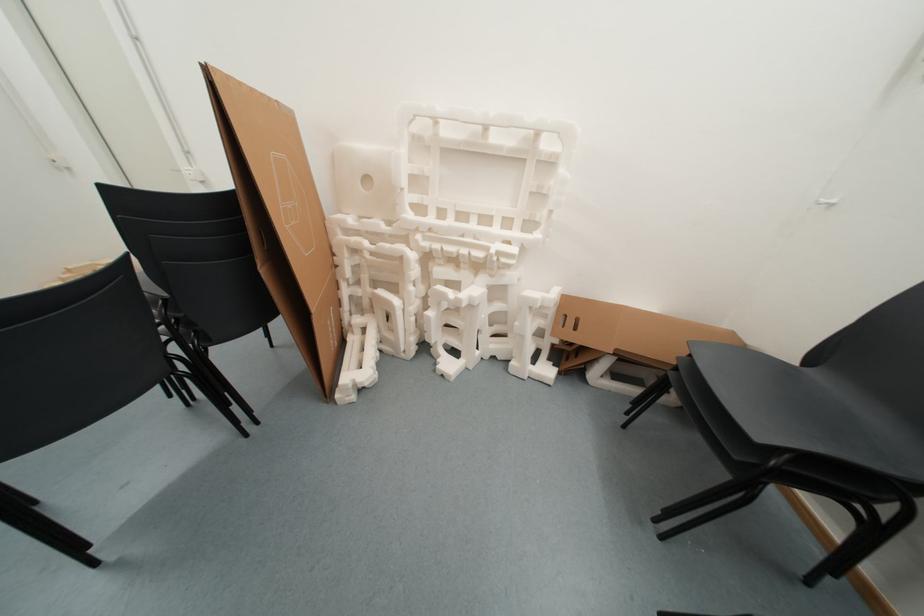
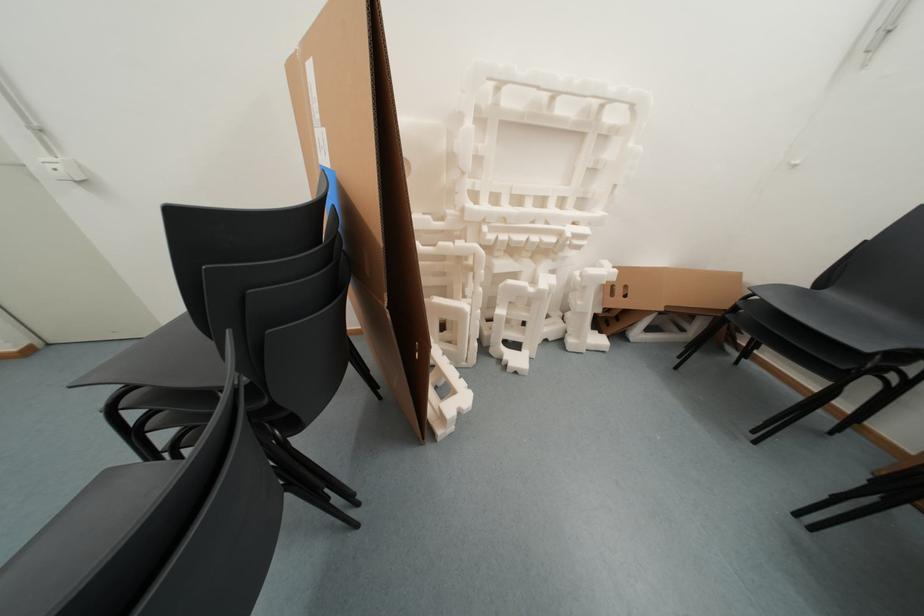
Question: The camera is either moving clockwise (left) or counter-clockwise (right) around the object. The first image is from the beginning of the video and the second image is from the end. Is the camera moving left or right when shooting the video?

Choices:
 (A) Left
 (B) Right

Answer: (A)